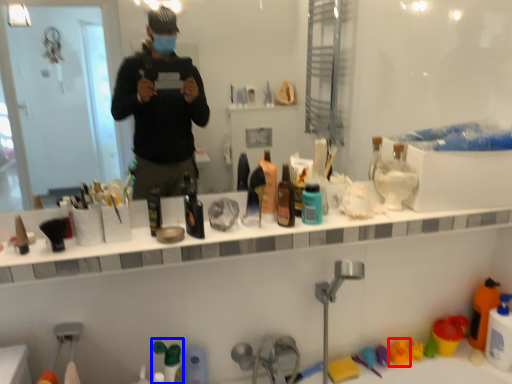
Question: Which of the following is the farthest to the observer, toy (highlighted by a red box) or toiletry (highlighted by a blue box)?

Choices:
 (A) toy
 (B) toiletry

Answer: (A)